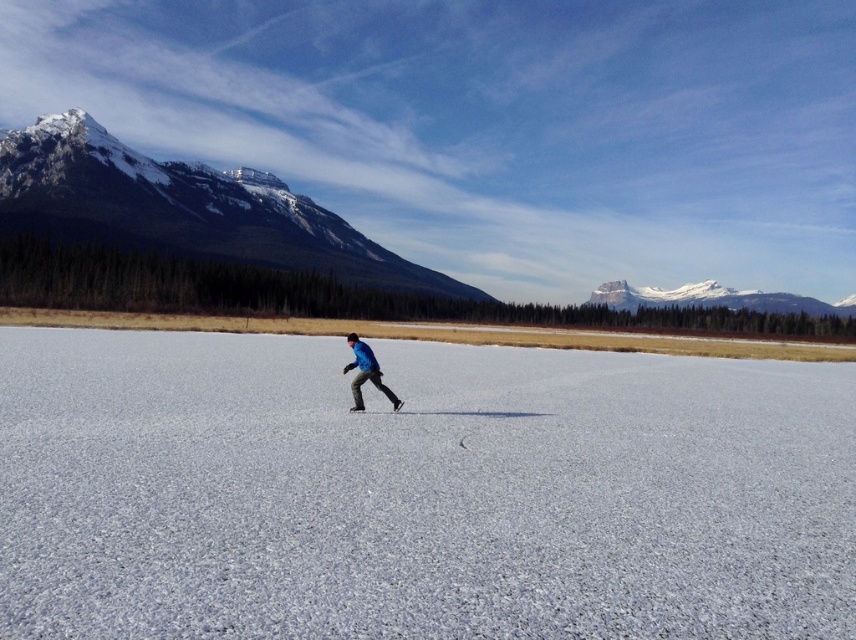
Is snowy granite mountain at upper left further to the viewer compared to black matte ski at center?

Yes, snowy granite mountain at upper left is behind black matte ski at center.

How far apart are snowy granite mountain at upper left and black matte ski at center?

snowy granite mountain at upper left is 223.91 meters from black matte ski at center.

Does point (70, 212) come behind point (354, 406)?

Yes.

Where is `snowy granite mountain at upper left`? This screenshot has width=856, height=640. snowy granite mountain at upper left is located at coordinates (188, 205).

Is white ice at center smaller than snowy granite mountain at upper center?

Correct, white ice at center occupies less space than snowy granite mountain at upper center.

From the picture: How distant is white ice at center from snowy granite mountain at upper center?

white ice at center and snowy granite mountain at upper center are 255.13 meters apart from each other.

You are a GUI agent. You are given a task and a screenshot of the screen. Output one action in this format:
    pyautogui.click(x=<x>, y=<y>)
    Task: Click on the white ice at center
    
    Given the screenshot: What is the action you would take?
    pyautogui.click(x=417, y=492)

At what (x,y) coordinates should I click in order to perform the action: click on white ice at center. Please return your answer as a coordinate pair (x, y). The height and width of the screenshot is (640, 856). Looking at the image, I should click on (417, 492).

Between snowy granite mountain at upper left and snowy granite mountain at upper center, which one is positioned lower?

snowy granite mountain at upper center is below.

Between snowy granite mountain at upper left and snowy granite mountain at upper center, which one appears on the right side from the viewer's perspective?

From the viewer's perspective, snowy granite mountain at upper center appears more on the right side.

At what (x,y) coordinates should I click in order to perform the action: click on snowy granite mountain at upper left. Please return your answer as a coordinate pair (x, y). This screenshot has width=856, height=640. Looking at the image, I should click on (188, 205).

At what (x,y) coordinates should I click in order to perform the action: click on snowy granite mountain at upper left. Please return your answer as a coordinate pair (x, y). Image resolution: width=856 pixels, height=640 pixels. Looking at the image, I should click on (188, 205).